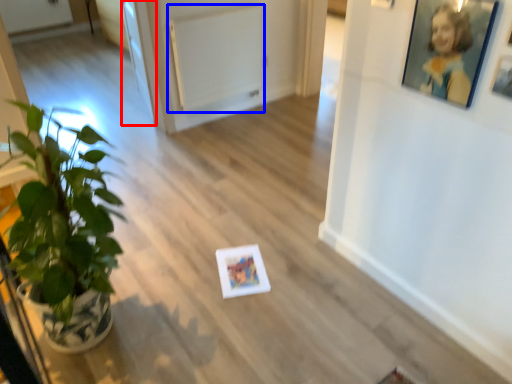
Question: Which object appears farthest to the camera in this image, glass door (highlighted by a red box) or radiator (highlighted by a blue box)?

Choices:
 (A) glass door
 (B) radiator

Answer: (A)